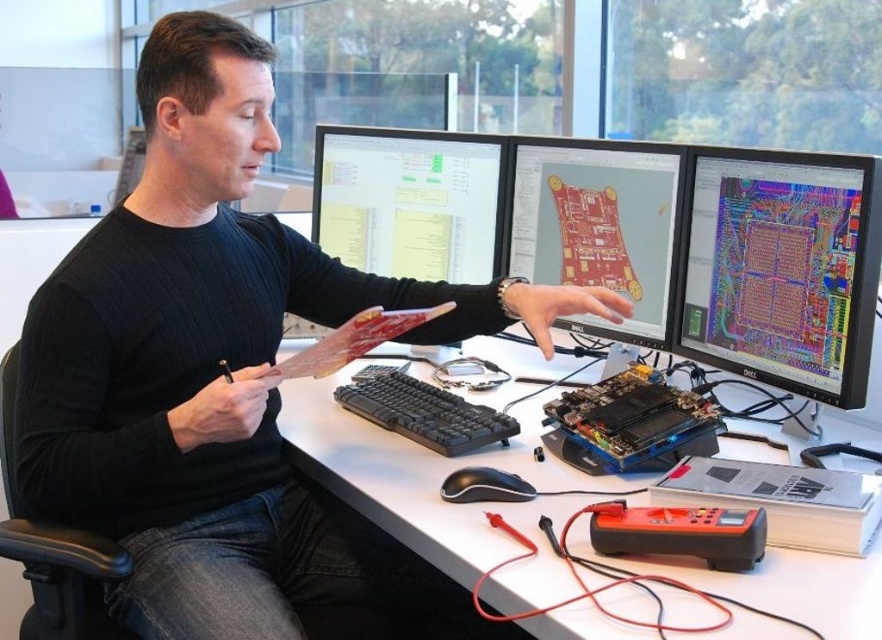
You are a technician trying to locate a specific point on the desk. The point is labeled as point (x=596, y=225). Based on the scene description, where is this point located?

The point (x=596, y=225) is on the matte plastic computer monitor at center.

You are an office worker who needs to reach the matte black monitor at right from your current position at the white plastic computer desk at center. Which object do you need to move past first?

You need to move past the white plastic computer desk at center first because it is closer to you than the matte black monitor at right, so you must go around or through it to reach the monitor.